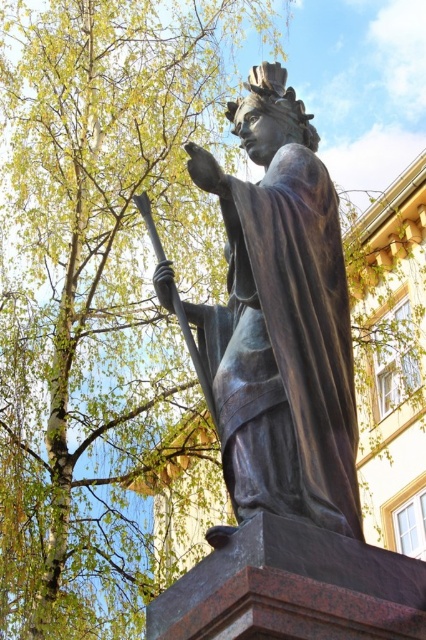
Between green leafy tree at upper left and shiny bronze statue at center, which one has more height?

With more height is green leafy tree at upper left.

Does green leafy tree at upper left have a greater width compared to shiny bronze statue at center?

Yes.

Image resolution: width=426 pixels, height=640 pixels. What do you see at coordinates (100, 289) in the screenshot?
I see `green leafy tree at upper left` at bounding box center [100, 289].

The image size is (426, 640). What are the coordinates of `green leafy tree at upper left` in the screenshot? It's located at (100, 289).